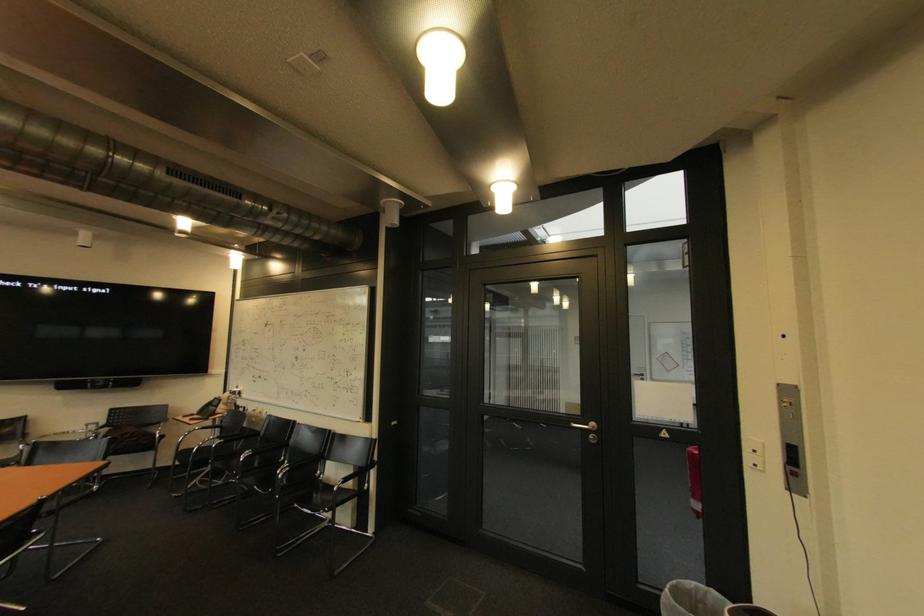
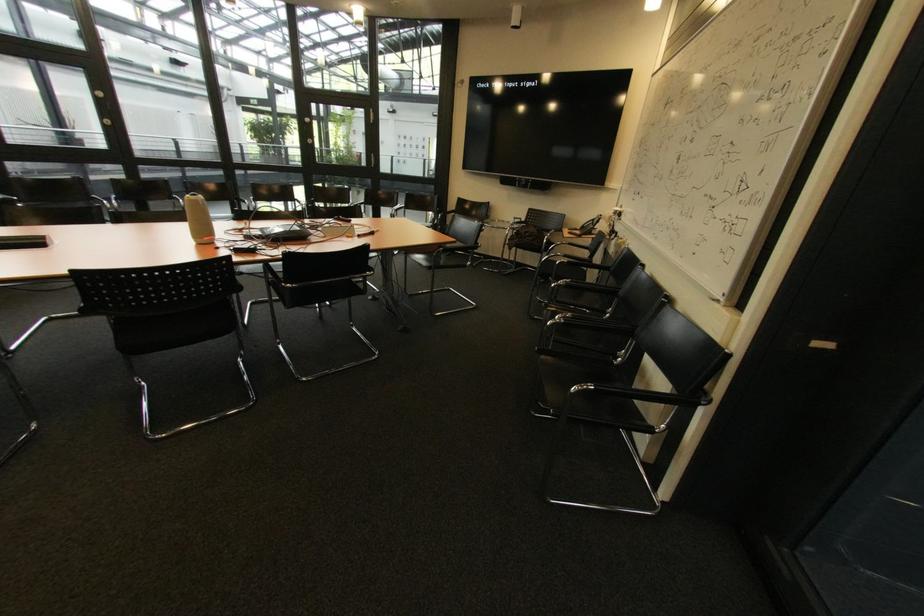
Where in the second image is the point corresponding to (211,430) from the first image?

(578, 245)